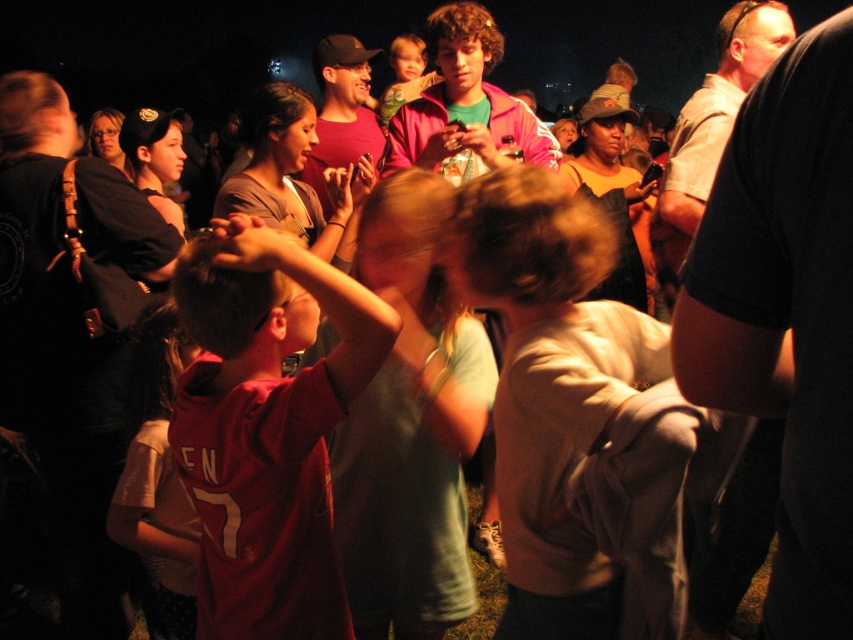
Locate an element on the screen. This screenshot has height=640, width=853. light brown cotton shirt at center is located at coordinates (582, 419).

Measure the distance between point (624, 406) and camera.

Point (624, 406) is 3.96 feet from camera.

Where is `light brown cotton shirt at center`? This screenshot has height=640, width=853. light brown cotton shirt at center is located at coordinates (582, 419).

In the scene shown: Is light brown cotton shirt at center to the left of matte red shirt at center from the viewer's perspective?

No, light brown cotton shirt at center is not to the left of matte red shirt at center.

Does light brown cotton shirt at center have a larger size compared to matte red shirt at center?

Indeed, light brown cotton shirt at center has a larger size compared to matte red shirt at center.

Locate an element on the screen. This screenshot has height=640, width=853. light brown cotton shirt at center is located at coordinates (582, 419).

Between matte red shirt at center and red jersey at center, which one is positioned higher?

matte red shirt at center is higher up.

Is matte red shirt at center above red jersey at center?

Correct, matte red shirt at center is located above red jersey at center.

Between point (308, 460) and point (141, 410), which one is positioned in front?

Point (308, 460) is more forward.

Identify the location of matte red shirt at center. (265, 428).